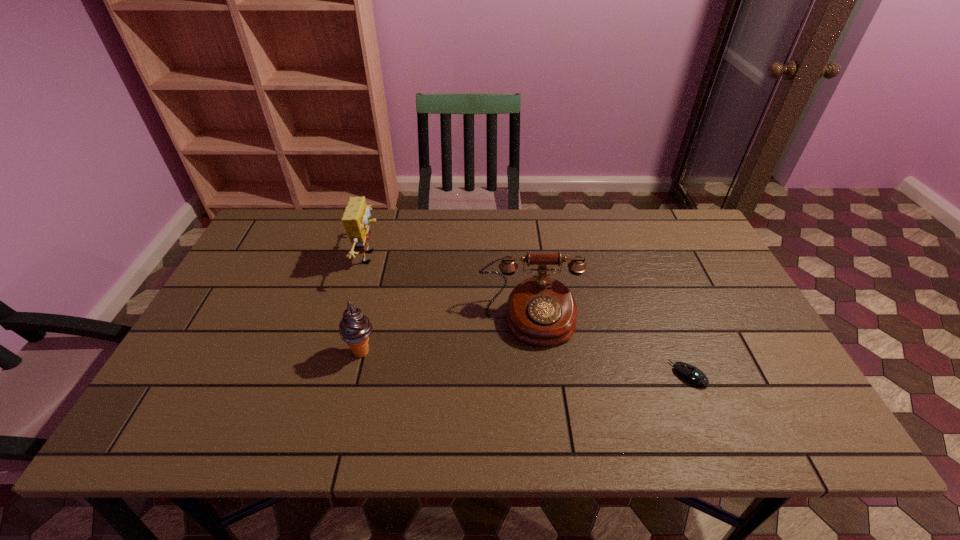
In the image, there is a desktop. Where is `vacant area at the far edge`? vacant area at the far edge is located at coordinates (370, 225).

Identify the location of vacant space at the near edge of the desktop. (251, 407).

Where is `blank area at the left edge`? The height and width of the screenshot is (540, 960). blank area at the left edge is located at coordinates (241, 348).

This screenshot has width=960, height=540. I want to click on vacant space at the right edge of the desktop, so click(732, 390).

Find the location of a particular element. vacant area at the far left corner of the desktop is located at coordinates (282, 221).

This screenshot has width=960, height=540. What are the coordinates of `vacant space at the near left corner of the desktop` in the screenshot? It's located at (199, 419).

You are a GUI agent. You are given a task and a screenshot of the screen. Output one action in this format:
    pyautogui.click(x=<x>, y=<y>)
    Task: Click on the vacant space at the far right corner
    The height and width of the screenshot is (540, 960).
    Given the screenshot: What is the action you would take?
    pyautogui.click(x=687, y=221)

Locate an element on the screen. Image resolution: width=960 pixels, height=540 pixels. empty location between the third object from left to right and the sponge is located at coordinates (450, 288).

Identify the location of free point between the second object from right to left and the farthest object. (450, 288).

Where is `vacant point located between the sponge and the icecream`? vacant point located between the sponge and the icecream is located at coordinates (366, 305).